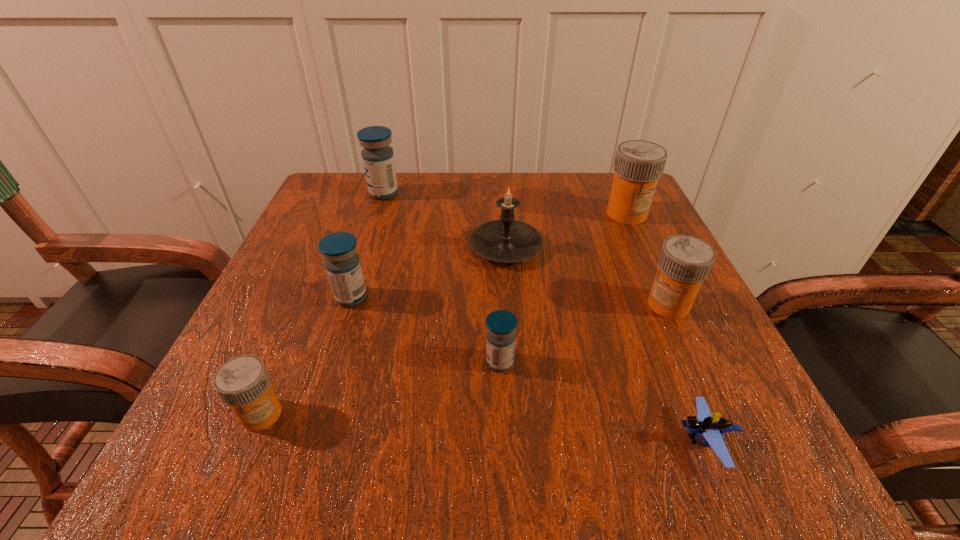
Where is `the farthest blue medicine`? Image resolution: width=960 pixels, height=540 pixels. the farthest blue medicine is located at coordinates (378, 160).

I want to click on the farthest medicine, so click(x=378, y=160).

The width and height of the screenshot is (960, 540). What are the coordinates of `the second farthest object` in the screenshot? It's located at (638, 165).

Locate an element on the screen. the second farthest medicine is located at coordinates (638, 165).

You are a GUI agent. You are given a task and a screenshot of the screen. Output one action in this format:
    pyautogui.click(x=<x>, y=<y>)
    Task: Click on the sixth nearest object
    Image resolution: width=960 pixels, height=540 pixels.
    Given the screenshot: What is the action you would take?
    pyautogui.click(x=506, y=240)

The image size is (960, 540). Identify the location of the second biggest orange medicine. click(685, 261).

This screenshot has height=540, width=960. I want to click on the second smallest blue medicine, so click(342, 263).

Locate an element on the screen. The image size is (960, 540). the nearest blue medicine is located at coordinates (501, 325).

Locate an element on the screen. the smallest blue medicine is located at coordinates (501, 325).

The height and width of the screenshot is (540, 960). What are the coordinates of `the leftmost medicine` in the screenshot? It's located at (243, 382).